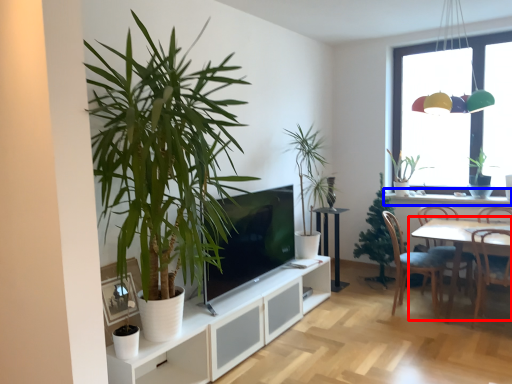
Question: Which object is closer to the camera taking this photo, table (highlighted by a red box) or window sill (highlighted by a blue box)?

Choices:
 (A) table
 (B) window sill

Answer: (A)